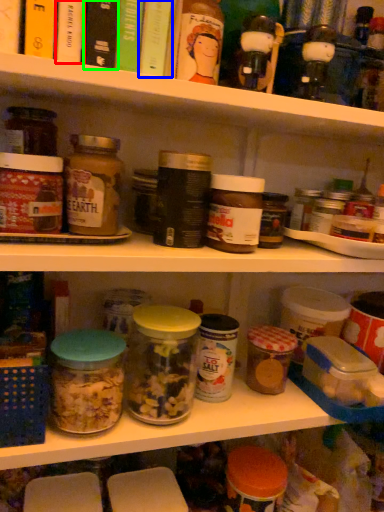
Question: Which object is the closest to the book (highlighted by a red box)? Choose among these: book (highlighted by a blue box) or book (highlighted by a green box).

Choices:
 (A) book
 (B) book

Answer: (B)